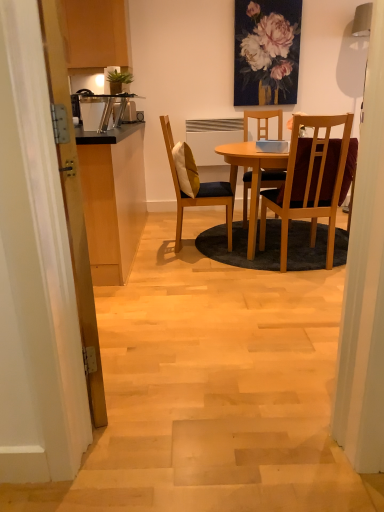
Find the location of a particular element. The width and height of the screenshot is (384, 512). vacant area that lies between wooden door at left and wooden chair with dark cushioning at center, which ranks as the 1th chair in right-to-left order is located at coordinates (209, 318).